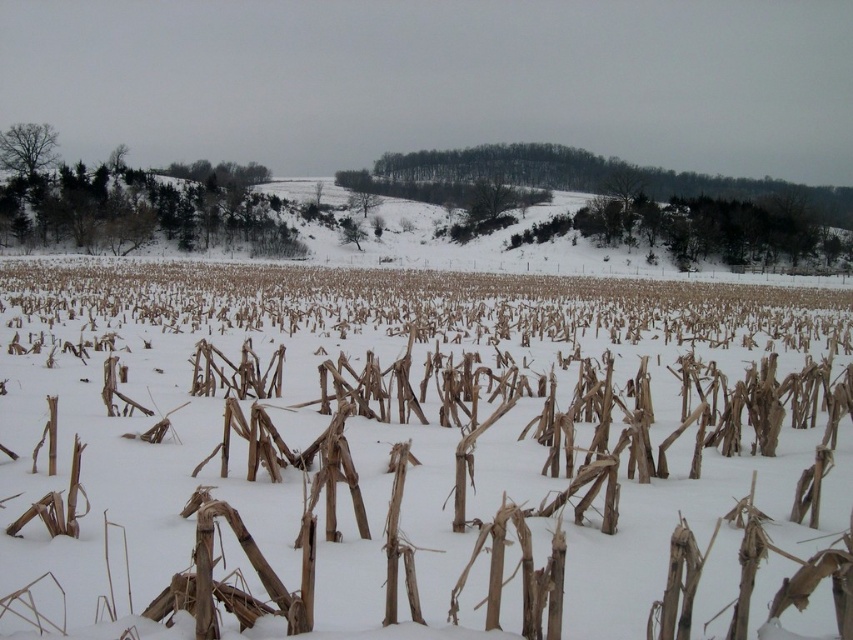
You are standing in the snow field and see the brown dry stalks at center and the bare branches at upper left. Which object is located to the right of the other?

The brown dry stalks at center is positioned on the right side of bare branches at upper left.

Based on the scene description, can you determine the direction of the green leafy trees marked by the point at coordinates (131,202)? Please explain your reasoning.

The point at coordinates (131,202) marks the green leafy trees at left, so they are located to the left side of the image.

You are a farmer assessing the winter crops. You notice the brown dry stalks at center and the green leafy trees at left. Which object is closer to the ground?

The brown dry stalks at center are closer to the ground because they are positioned under the green leafy trees at left.